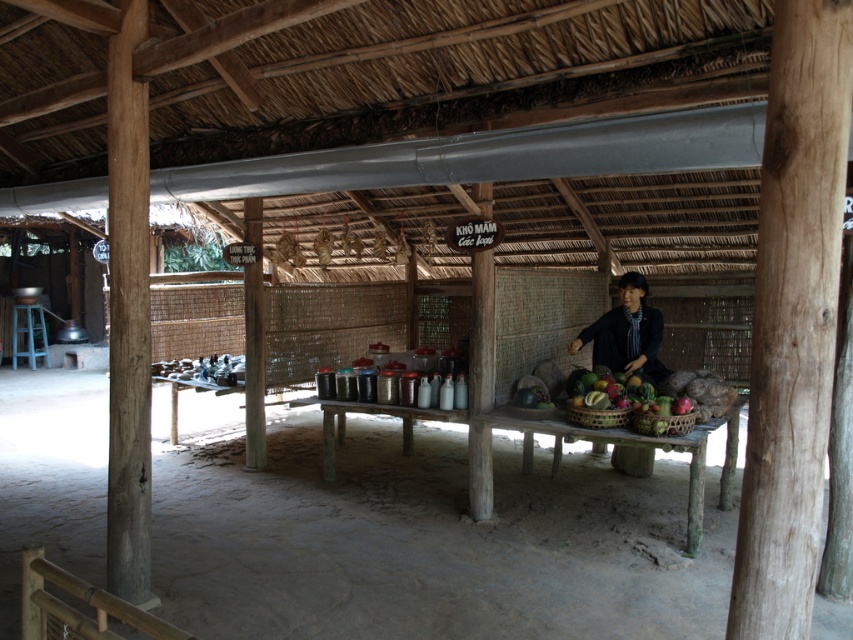
Question: Which of the following is the closest to the observer?

Choices:
 (A) (616, 332)
 (B) (689, 429)

Answer: (B)

Question: Does wooden table at center appear on the right side of wooden woven basket at center?

Choices:
 (A) yes
 (B) no

Answer: (B)

Question: From the image, what is the correct spatial relationship of wooden table at center in relation to wooden woven basket at center?

Choices:
 (A) right
 (B) left

Answer: (B)

Question: Which of the following is the farthest from the observer?

Choices:
 (A) wooden woven basket at center
 (B) brown woven basket at center
 (C) dark blue shirt at center

Answer: (C)

Question: Which of the following is the farthest from the observer?

Choices:
 (A) (618, 424)
 (B) (634, 410)
 (C) (645, 336)
 (D) (305, 401)

Answer: (D)

Question: Is the position of dark blue shirt at center more distant than that of brown woven basket at center?

Choices:
 (A) yes
 (B) no

Answer: (A)